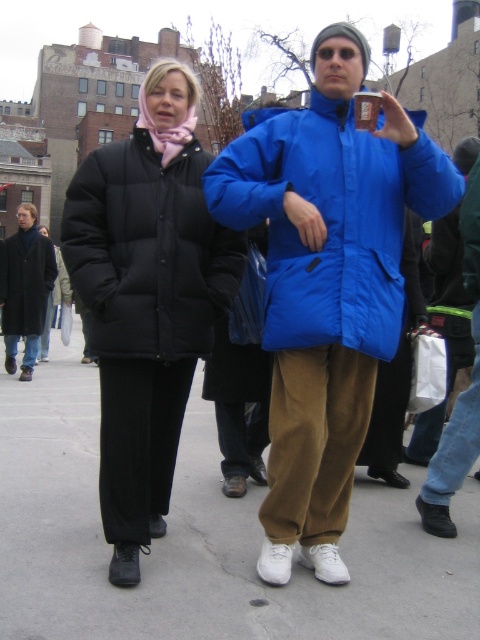
You are a delivery person who needs to place a large package on the ground. You see the white concrete pavement at center and the black puffy coat at left. Which surface can accommodate the package better?

The white concrete pavement at center has a larger size compared to the black puffy coat at left, so it can accommodate the large package better.

You are a delivery robot with a 1 meter wide package. You need to navigate through the street shown in the image. The path is between the white concrete pavement at center and the black puffy coat at left. Can you fit through the path?

The white concrete pavement at center is wider than the black puffy coat at left, so the path between them is wider than the robot and its package. Therefore, the delivery robot can fit through the path between the white concrete pavement at center and the black puffy coat at left.